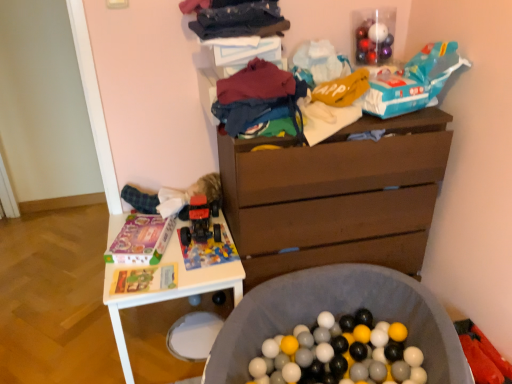
You are a GUI agent. You are given a task and a screenshot of the screen. Output one action in this format:
    pyautogui.click(x=<x>, y=<y>)
    Task: Click on the blank area beneath rubberized plastic toy car at center, positioned as the 1th toy in left-to-right order (from a real-world perspective)
    This screenshot has width=512, height=384.
    Given the screenshot: What is the action you would take?
    pyautogui.click(x=201, y=237)